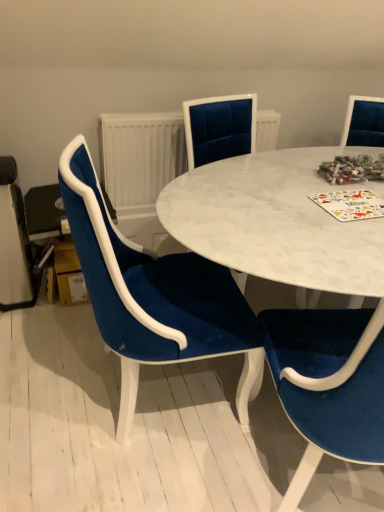
Question: In the image, is velvet blue chair at left, which is the first chair in left-to-right order, on the left side or the right side of white marble table at center?

Choices:
 (A) left
 (B) right

Answer: (A)

Question: From the image's perspective, is velvet blue chair at left, which appears as the second chair when viewed from the right, positioned above or below white marble table at center?

Choices:
 (A) above
 (B) below

Answer: (B)

Question: Which object is positioned closest to the white marble table at center?

Choices:
 (A) multicolored paper at center
 (B) velvet blue chair at left, which is the first chair in left-to-right order
 (C) white textured radiator at center
 (D) velvet blue chair at center, which is the 1th chair in right-to-left order

Answer: (A)

Question: Which is nearer to the multicolored paper at center?

Choices:
 (A) velvet blue chair at center, which is the 1th chair in right-to-left order
 (B) white marble table at center
 (C) velvet blue chair at left, which appears as the second chair when viewed from the right
 (D) white textured radiator at center

Answer: (B)